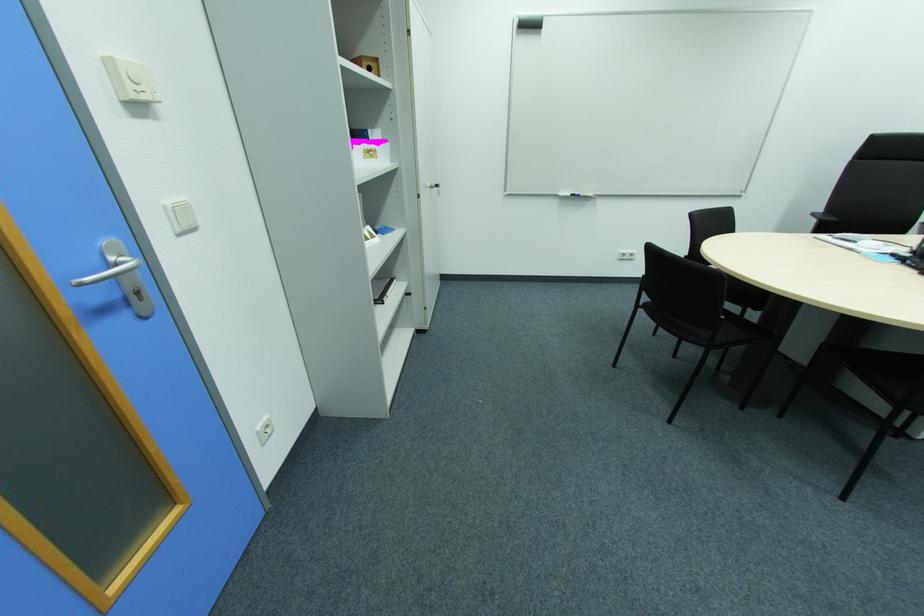
At what (x,y) coordinates should I click in order to perform the action: click on white light switch. Please return your answer as a coordinate pair (x, y). The height and width of the screenshot is (616, 924). Looking at the image, I should click on (180, 216).